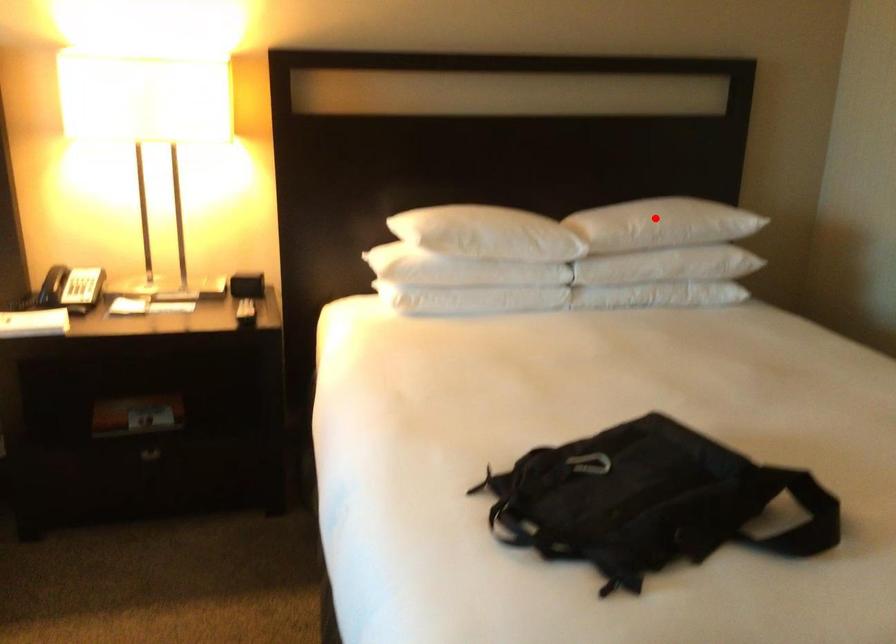
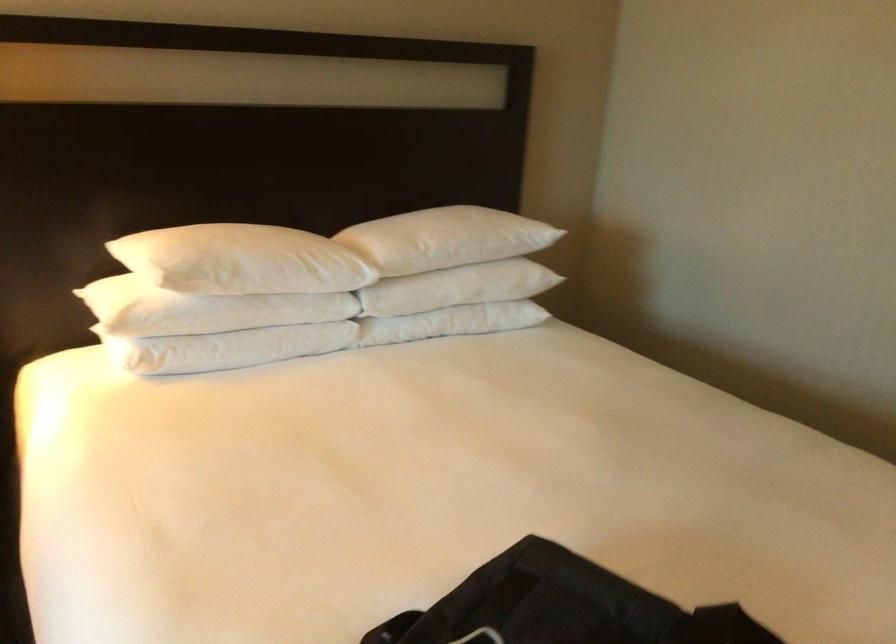
Question: I am providing you with two images of the same scene from different viewpoints. In image1, a red point is highlighted. Considering the same 3D point in image2, which of the following is correct?

Choices:
 (A) It is closer
 (B) It is farther

Answer: (A)